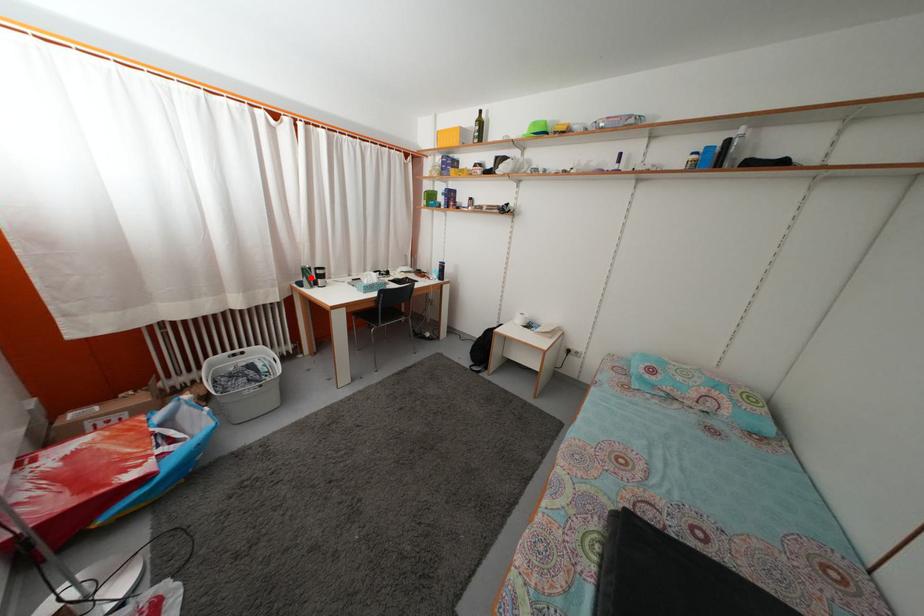
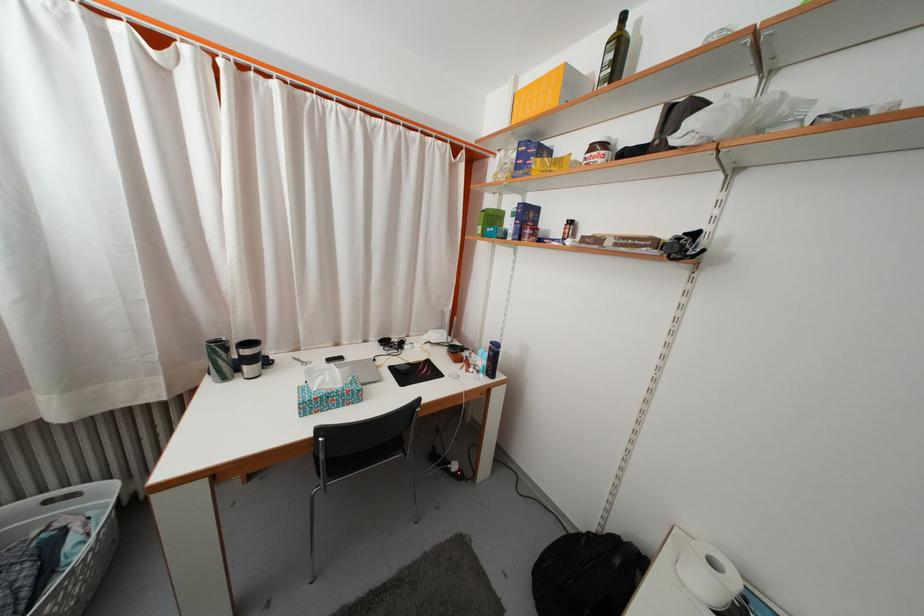
Find the pixel in the second image that matches the highlighted location in the first image.

(225, 354)